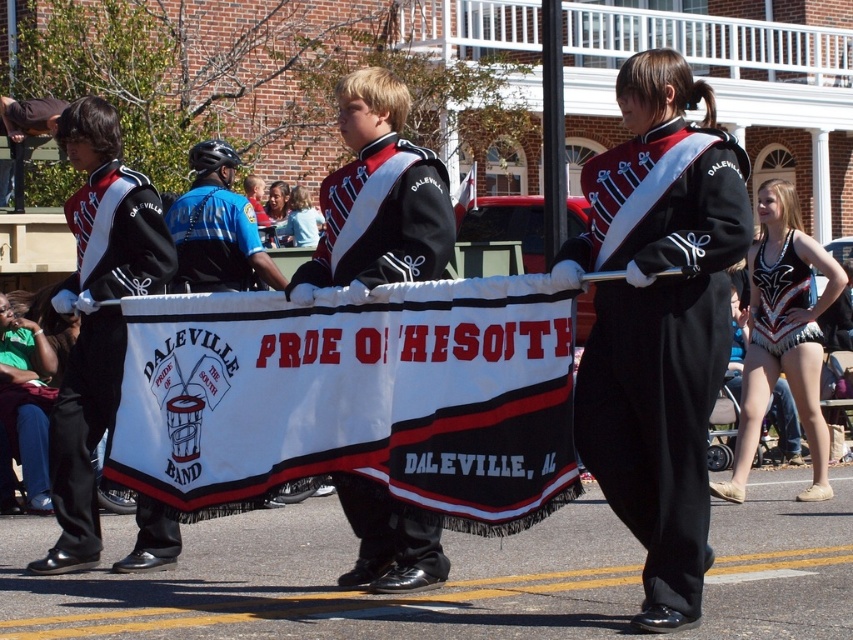
What is the location of the white fabric banner at center in the image?

The white fabric banner at center is located at point (352, 397).